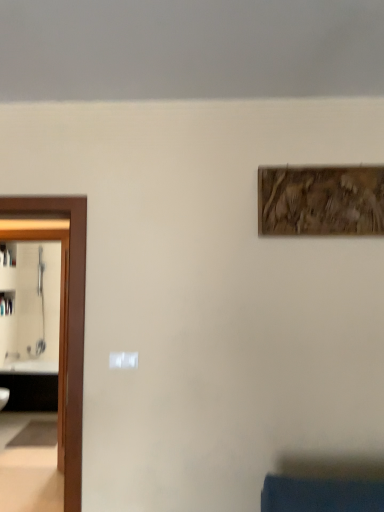
Question: Is brown wooden door at left behind wooden textured artwork at upper right?

Choices:
 (A) yes
 (B) no

Answer: (B)

Question: Can you confirm if brown wooden door at left is positioned to the left of wooden textured artwork at upper right?

Choices:
 (A) yes
 (B) no

Answer: (A)

Question: Considering the relative sizes of brown wooden door at left and wooden textured artwork at upper right in the image provided, is brown wooden door at left shorter than wooden textured artwork at upper right?

Choices:
 (A) yes
 (B) no

Answer: (B)

Question: Is brown wooden door at left positioned before wooden textured artwork at upper right?

Choices:
 (A) no
 (B) yes

Answer: (B)

Question: Is brown wooden door at left positioned beyond the bounds of wooden textured artwork at upper right?

Choices:
 (A) yes
 (B) no

Answer: (A)

Question: From a real-world perspective, is brown wooden door at left above or below wooden textured artwork at upper right?

Choices:
 (A) above
 (B) below

Answer: (B)

Question: Is point (77, 345) positioned closer to the camera than point (259, 174)?

Choices:
 (A) closer
 (B) farther

Answer: (A)

Question: Based on their sizes in the image, would you say brown wooden door at left is bigger or smaller than wooden textured artwork at upper right?

Choices:
 (A) small
 (B) big

Answer: (B)

Question: Considering their positions, is brown wooden door at left located in front of or behind wooden textured artwork at upper right?

Choices:
 (A) behind
 (B) front

Answer: (B)

Question: Considering the positions of white glossy sink at left and brown wooden door at left in the image, is white glossy sink at left taller or shorter than brown wooden door at left?

Choices:
 (A) short
 (B) tall

Answer: (A)

Question: Does point (14, 401) appear closer or farther from the camera than point (74, 279)?

Choices:
 (A) closer
 (B) farther

Answer: (B)

Question: Visually, is white glossy sink at left positioned to the left or to the right of brown wooden door at left?

Choices:
 (A) right
 (B) left

Answer: (B)

Question: From a real-world perspective, is white glossy sink at left physically located above or below brown wooden door at left?

Choices:
 (A) above
 (B) below

Answer: (B)

Question: Is wooden textured artwork at upper right inside or outside of brown wooden door at left?

Choices:
 (A) outside
 (B) inside

Answer: (A)

Question: From their relative heights in the image, would you say wooden textured artwork at upper right is taller or shorter than brown wooden door at left?

Choices:
 (A) tall
 (B) short

Answer: (B)